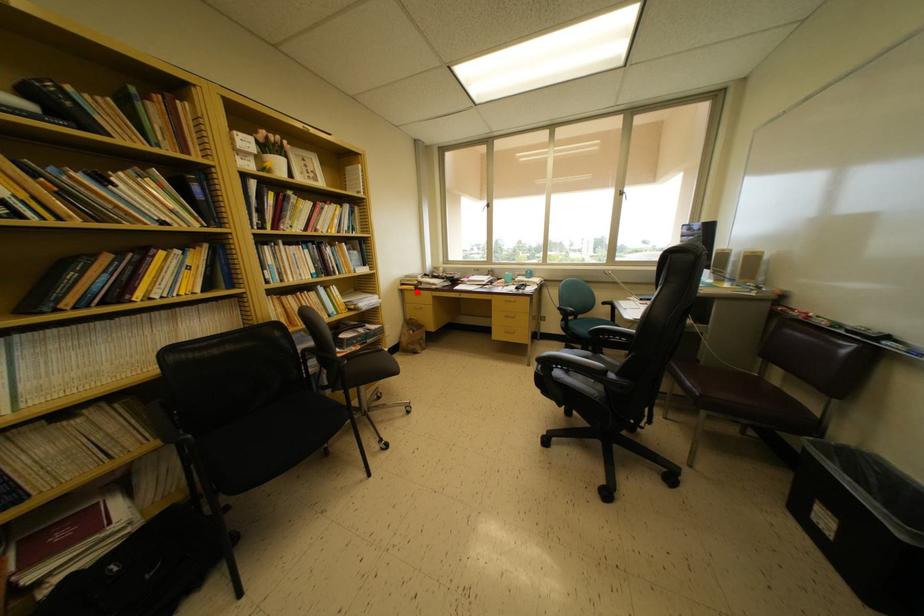
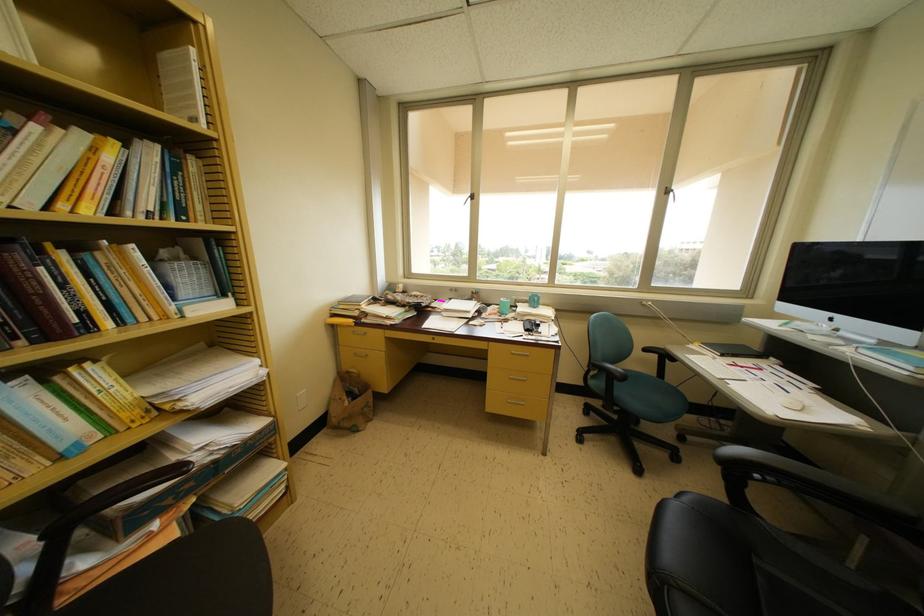
Question: I am providing you with two images of the same scene from different viewpoints. Given a red point in image1, look at the same physical point in image2. Is it:

Choices:
 (A) Closer to the viewpoint
 (B) Farther from the viewpoint

Answer: (B)